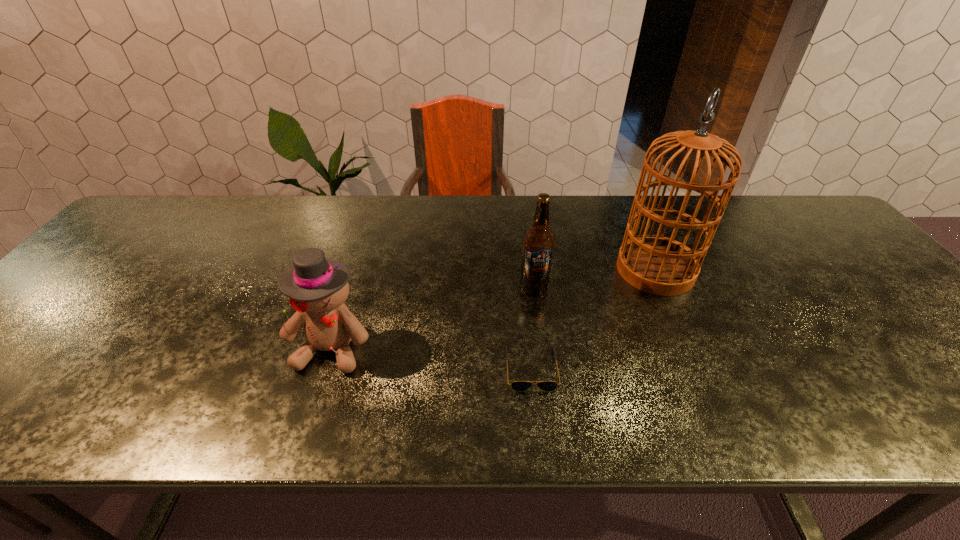
At what (x,y) coordinates should I click in order to perform the action: click on free location at the near edge of the desktop. Please return your answer as a coordinate pair (x, y). Image resolution: width=960 pixels, height=540 pixels. Looking at the image, I should click on (66, 393).

I want to click on vacant space at the left edge of the desktop, so click(133, 247).

Image resolution: width=960 pixels, height=540 pixels. Identify the location of vacant space at the right edge of the desktop. (939, 351).

The height and width of the screenshot is (540, 960). I want to click on free region at the far left corner, so pyautogui.click(x=194, y=195).

Image resolution: width=960 pixels, height=540 pixels. In order to click on free space at the far right corner of the desktop in this screenshot , I will do `click(824, 221)`.

Locate an element on the screen. Image resolution: width=960 pixels, height=540 pixels. vacant point located between the rightmost object and the shortest object is located at coordinates (593, 319).

Find the location of a particular element. This screenshot has width=960, height=540. free spot between the beer bottle and the shortest object is located at coordinates [x=533, y=328].

At what (x,y) coordinates should I click in order to perform the action: click on blank region between the tallest object and the shortest object. Please return your answer as a coordinate pair (x, y). The width and height of the screenshot is (960, 540). Looking at the image, I should click on (593, 319).

This screenshot has height=540, width=960. I want to click on free space between the leftmost object and the tallest object, so click(x=493, y=308).

Find the location of a particular element. vacant point located between the tallest object and the rag_doll is located at coordinates (493, 308).